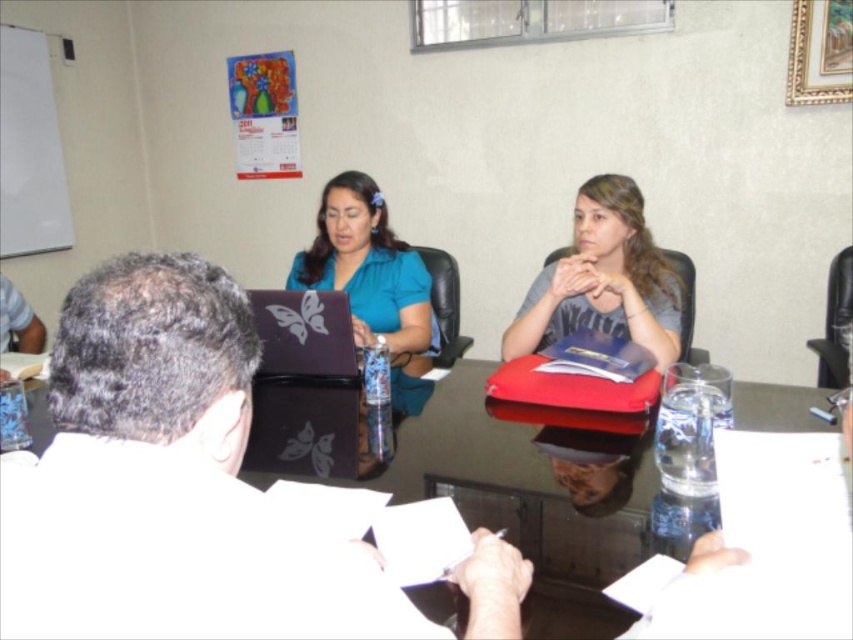
Question: Which of the following is the farthest from the observer?

Choices:
 (A) (299, 276)
 (B) (248, 296)
 (C) (120, 557)

Answer: (A)

Question: Which is farther from the matte gray folder at center?

Choices:
 (A) transparent glass table at center
 (B) matte blue laptop at center

Answer: (A)

Question: Does transparent glass table at center come in front of matte black laptop at center?

Choices:
 (A) yes
 (B) no

Answer: (A)

Question: Which of the following is the closest to the observer?

Choices:
 (A) (561, 289)
 (B) (10, 604)

Answer: (B)

Question: Does transparent glass table at center appear on the right side of matte gray folder at center?

Choices:
 (A) yes
 (B) no

Answer: (B)

Question: Is matte gray folder at center above matte black laptop at center?

Choices:
 (A) no
 (B) yes

Answer: (B)